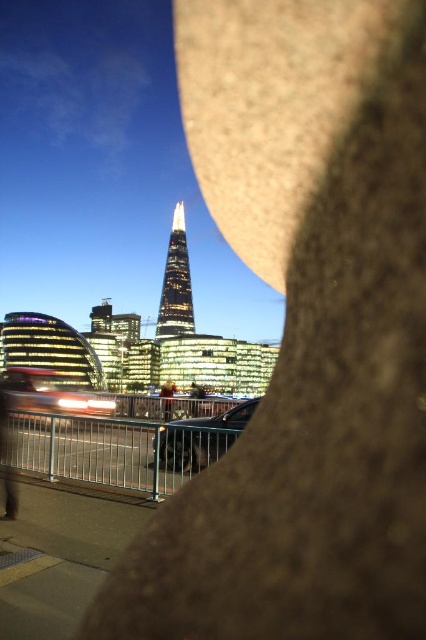
Does point (175, 227) come in front of point (166, 381)?

No.

What do you see at coordinates (175, 284) in the screenshot? I see `glassy reflective tower at center` at bounding box center [175, 284].

The width and height of the screenshot is (426, 640). In order to click on glassy reflective tower at center in this screenshot , I will do `click(175, 284)`.